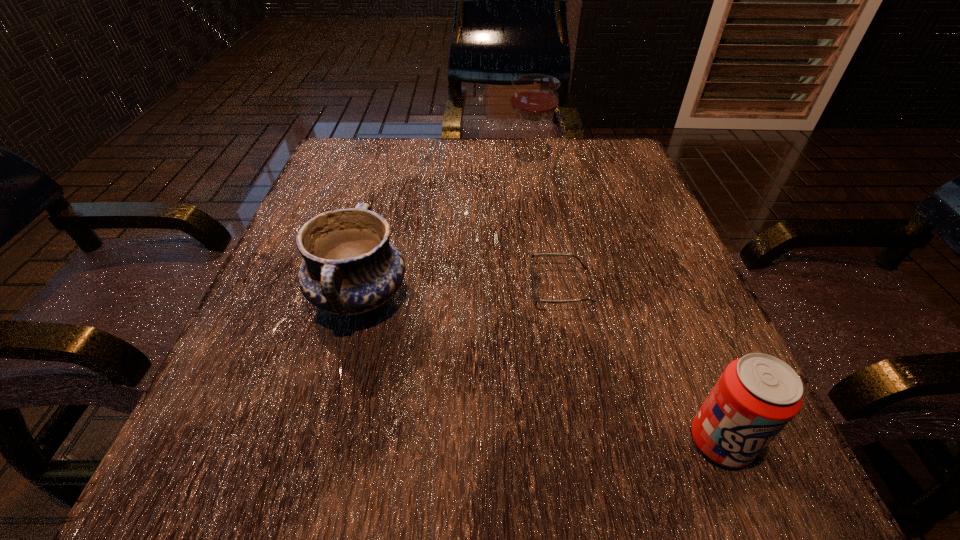
Locate an element on the screen. The height and width of the screenshot is (540, 960). vacant space that's between the shortest object and the pottery is located at coordinates (460, 292).

Locate an element on the screen. free area in between the nearest object and the pottery is located at coordinates (540, 369).

At what (x,y) coordinates should I click in order to perform the action: click on the second closest object to the wineglass. Please return your answer as a coordinate pair (x, y). The width and height of the screenshot is (960, 540). Looking at the image, I should click on coord(350,267).

At what (x,y) coordinates should I click in order to perform the action: click on object that can be found as the third closest to the tallest object. Please return your answer as a coordinate pair (x, y). This screenshot has width=960, height=540. Looking at the image, I should click on (756, 396).

In order to click on free space that satisfies the following two spatial constraints: 1. on the front-facing side of the shortest object; 2. on the front side of the leftmost object in this screenshot , I will do `click(563, 297)`.

You are a GUI agent. You are given a task and a screenshot of the screen. Output one action in this format:
    pyautogui.click(x=<x>, y=<y>)
    Task: Click on the vacant region that satisfies the following two spatial constraints: 1. on the front-facing side of the sunglasses; 2. on the front side of the leftmost object
    The width and height of the screenshot is (960, 540).
    Given the screenshot: What is the action you would take?
    pyautogui.click(x=563, y=297)